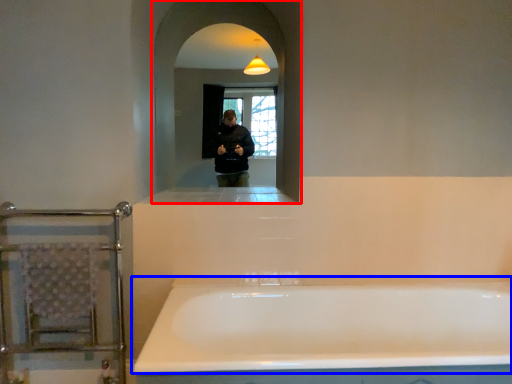
Question: Which point is further to the camera, mirror (highlighted by a red box) or bathtub (highlighted by a blue box)?

Choices:
 (A) mirror
 (B) bathtub

Answer: (A)